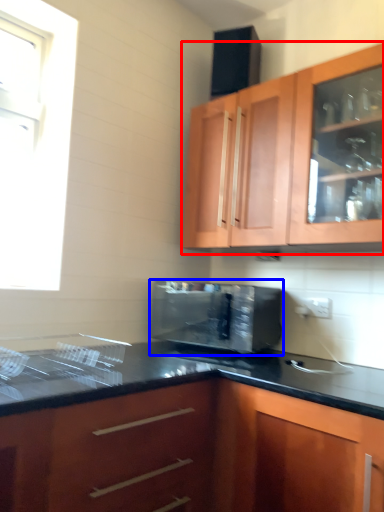
Question: Among these objects, which one is nearest to the camera, cabinetry (highlighted by a red box) or microwave oven (highlighted by a blue box)?

Choices:
 (A) cabinetry
 (B) microwave oven

Answer: (A)